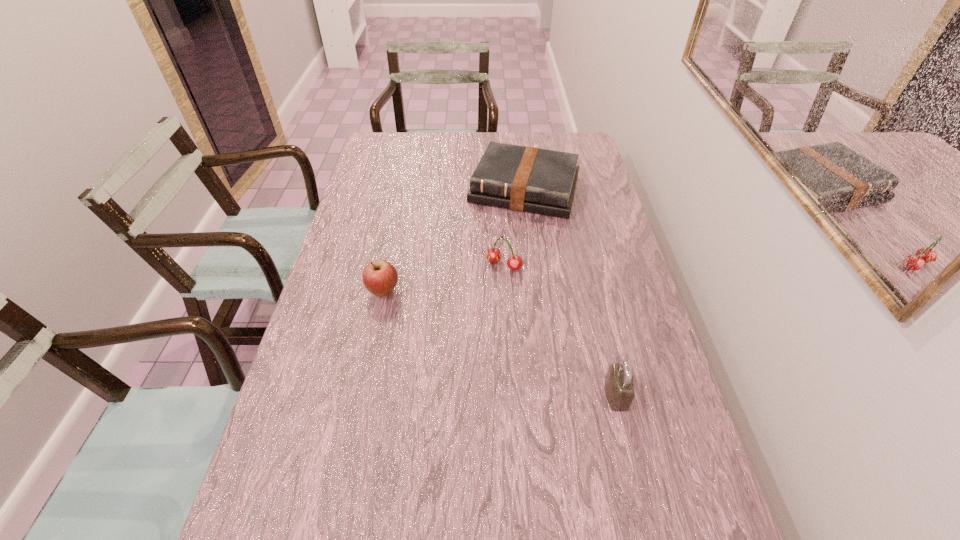
What are the coordinates of `the leftmost object` in the screenshot? It's located at (380, 277).

This screenshot has height=540, width=960. I want to click on the second nearest object, so click(380, 277).

Identify the location of the nearest object. This screenshot has width=960, height=540. (619, 385).

At what (x,y) coordinates should I click in order to perform the action: click on the third nearest object. Please return your answer as a coordinate pair (x, y). Looking at the image, I should click on (493, 255).

This screenshot has height=540, width=960. What are the coordinates of `hardback book` in the screenshot? It's located at (526, 179).

Locate an element on the screen. The image size is (960, 540). the shortest object is located at coordinates (526, 179).

Locate an element on the screen. free space located 0.360m on the right of the apple is located at coordinates (527, 291).

Where is `vacant space situated 0.060m at the front of the nearest object near the keyhole`? vacant space situated 0.060m at the front of the nearest object near the keyhole is located at coordinates (653, 395).

Image resolution: width=960 pixels, height=540 pixels. Find the location of `free point located with stems pointing upwards on the cherry`. free point located with stems pointing upwards on the cherry is located at coordinates (443, 343).

At what (x,y) coordinates should I click in order to perform the action: click on vacant space located 0.280m with stems pointing upwards on the cherry. Please return your answer as a coordinate pair (x, y). This screenshot has width=960, height=540. Looking at the image, I should click on (444, 341).